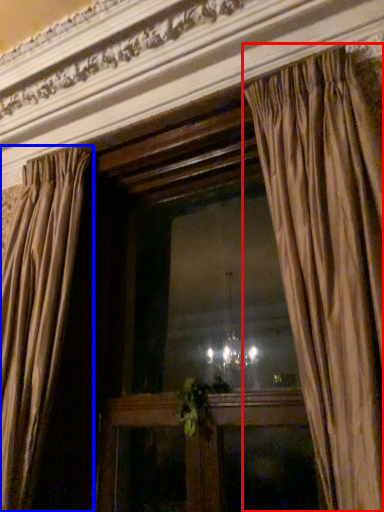
Question: Which of the following is the farthest to the observer, curtain (highlighted by a red box) or curtain (highlighted by a blue box)?

Choices:
 (A) curtain
 (B) curtain

Answer: (B)